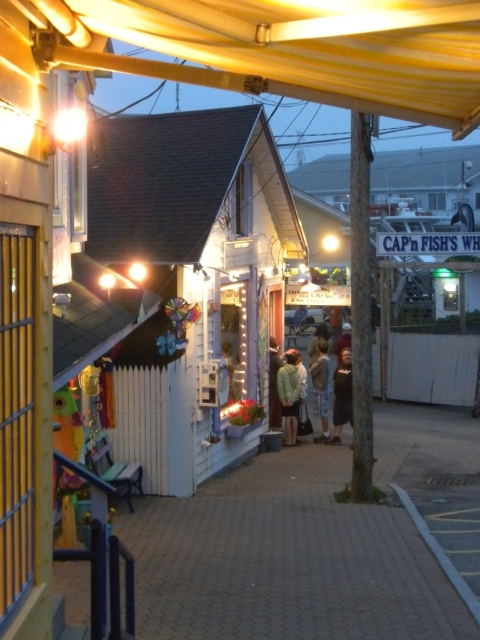
Measure the distance from black cotton shirt at center-right to light brown fabric shirt at center.

A distance of 20.49 inches exists between black cotton shirt at center-right and light brown fabric shirt at center.

Who is lower down, black cotton shirt at center-right or light brown fabric shirt at center?

black cotton shirt at center-right

In order to click on black cotton shirt at center-right in this screenshot , I will do `click(342, 396)`.

At what (x,y) coordinates should I click in order to perform the action: click on black cotton shirt at center-right. Please return your answer as a coordinate pair (x, y). The width and height of the screenshot is (480, 640). Looking at the image, I should click on (342, 396).

Who is positioned more to the left, green matte jacket at center or light brown fabric shirt at center?

green matte jacket at center is more to the left.

Is green matte jacket at center closer to the viewer compared to light brown fabric shirt at center?

Yes, green matte jacket at center is in front of light brown fabric shirt at center.

Who is more distant from viewer, (294, 369) or (319, 365)?

Positioned behind is point (319, 365).

You are a GUI agent. You are given a task and a screenshot of the screen. Output one action in this format:
    pyautogui.click(x=<x>, y=<y>)
    Task: Click on the green matte jacket at center
    The width and height of the screenshot is (480, 640).
    Given the screenshot: What is the action you would take?
    pyautogui.click(x=288, y=396)

Consider the image. Can you confirm if white wooden hut at center is positioned below light brown fabric shirt at center?

Incorrect, white wooden hut at center is not positioned below light brown fabric shirt at center.

Which of these two, white wooden hut at center or light brown fabric shirt at center, stands taller?

Standing taller between the two is white wooden hut at center.

Is point (186, 476) positioned before point (325, 368)?

Yes, point (186, 476) is closer to viewer.

Identify the location of white wooden hut at center. (192, 275).